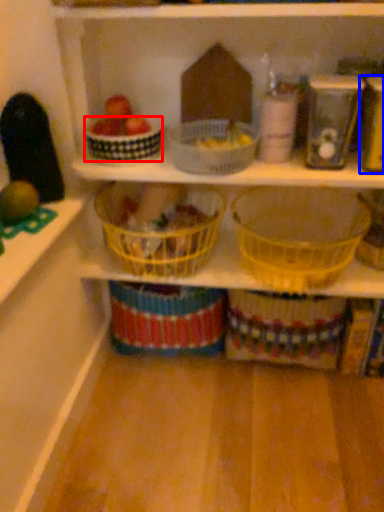
Question: Which object appears closest to the camera in this image, basket (highlighted by a red box) or appliance (highlighted by a blue box)?

Choices:
 (A) basket
 (B) appliance

Answer: (B)